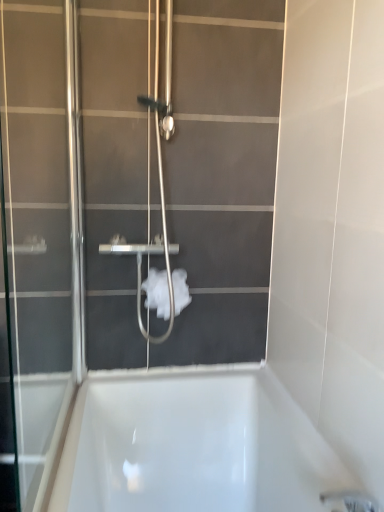
Where is `white fluffy toilet paper at center`? The height and width of the screenshot is (512, 384). white fluffy toilet paper at center is located at coordinates (157, 292).

In order to face white fluffy toilet paper at center, should I rotate leftwards or rightwards?

Rotate left and turn 3.543 degrees.

Measure the distance between point (153,284) and camera.

Point (153,284) is 4.65 feet from camera.

This screenshot has height=512, width=384. Describe the element at coordinates (157, 292) in the screenshot. I see `white fluffy toilet paper at center` at that location.

You are a GUI agent. You are given a task and a screenshot of the screen. Output one action in this format:
    pyautogui.click(x=<x>, y=<y>)
    Task: Click on the transparent glass screen door at left
    The image size is (384, 512).
    Given the screenshot: What is the action you would take?
    pyautogui.click(x=41, y=232)

What do you see at coordinates (41, 232) in the screenshot?
I see `transparent glass screen door at left` at bounding box center [41, 232].

Find the location of a particular element. The height and width of the screenshot is (512, 384). white fluffy toilet paper at center is located at coordinates (157, 292).

Is white fluffy toilet paper at center to the right of transparent glass screen door at left from the viewer's perspective?

Indeed, white fluffy toilet paper at center is positioned on the right side of transparent glass screen door at left.

Is white fluffy toilet paper at center behind transparent glass screen door at left?

Yes, white fluffy toilet paper at center is further from the camera.

Which point is more forward, (152, 296) or (58, 10)?

The point (58, 10) is more forward.

From the image's perspective, is white fluffy toilet paper at center located above or below transparent glass screen door at left?

Based on their image positions, white fluffy toilet paper at center is located beneath transparent glass screen door at left.

From a real-world perspective, between white fluffy toilet paper at center and transparent glass screen door at left, who is vertically lower?

white fluffy toilet paper at center, from a real-world perspective.

Is white fluffy toilet paper at center wider or thinner than transparent glass screen door at left?

white fluffy toilet paper at center is wider than transparent glass screen door at left.

Considering the sizes of objects white fluffy toilet paper at center and transparent glass screen door at left in the image provided, who is taller, white fluffy toilet paper at center or transparent glass screen door at left?

With more height is transparent glass screen door at left.

Considering the sizes of objects white fluffy toilet paper at center and transparent glass screen door at left in the image provided, who is bigger, white fluffy toilet paper at center or transparent glass screen door at left?

Bigger between the two is transparent glass screen door at left.

Is transparent glass screen door at left a part of white fluffy toilet paper at center?

That's incorrect, transparent glass screen door at left is not inside white fluffy toilet paper at center.

Is white fluffy toilet paper at center beside transparent glass screen door at left?

No.

Could you tell me if white fluffy toilet paper at center is facing transparent glass screen door at left?

No, white fluffy toilet paper at center is not aimed at transparent glass screen door at left.

How much distance is there between white fluffy toilet paper at center and transparent glass screen door at left?

white fluffy toilet paper at center and transparent glass screen door at left are 17.61 inches apart from each other.

Where is `screen door above the white fluffy toilet paper at center (from a real-world perspective)`? This screenshot has width=384, height=512. screen door above the white fluffy toilet paper at center (from a real-world perspective) is located at coordinates (41, 232).

From the picture: Between transparent glass screen door at left and white fluffy toilet paper at center, which one appears on the right side from the viewer's perspective?

white fluffy toilet paper at center is more to the right.

In the scene shown: Relative to white fluffy toilet paper at center, is transparent glass screen door at left in front or behind?

Visually, transparent glass screen door at left is located in front of white fluffy toilet paper at center.

Is point (57, 186) positioned in front of point (161, 301)?

That is True.

From the image's perspective, relative to white fluffy toilet paper at center, is transparent glass screen door at left above or below?

transparent glass screen door at left is above white fluffy toilet paper at center.

From a real-world perspective, is transparent glass screen door at left below white fluffy toilet paper at center?

No, from a real-world perspective, transparent glass screen door at left is not below white fluffy toilet paper at center.

Is transparent glass screen door at left thinner than white fluffy toilet paper at center?

Yes, transparent glass screen door at left is thinner than white fluffy toilet paper at center.

Does transparent glass screen door at left have a lesser height compared to white fluffy toilet paper at center?

No, transparent glass screen door at left is not shorter than white fluffy toilet paper at center.

Which of these two, transparent glass screen door at left or white fluffy toilet paper at center, is bigger?

Bigger between the two is transparent glass screen door at left.

Is white fluffy toilet paper at center completely or partially inside transparent glass screen door at left?

No, white fluffy toilet paper at center is not surrounded by transparent glass screen door at left.

Based on the photo, are transparent glass screen door at left and white fluffy toilet paper at center far apart?

No, transparent glass screen door at left is not far from white fluffy toilet paper at center.

Is transparent glass screen door at left facing towards white fluffy toilet paper at center?

No, transparent glass screen door at left is not turned towards white fluffy toilet paper at center.

What's the angular difference between transparent glass screen door at left and white fluffy toilet paper at center's facing directions?

The facing directions of transparent glass screen door at left and white fluffy toilet paper at center are 89 degrees apart.

How distant is transparent glass screen door at left from white fluffy toilet paper at center?

transparent glass screen door at left and white fluffy toilet paper at center are 17.61 inches apart.

The image size is (384, 512). Identify the location of screen door that is on the left side of white fluffy toilet paper at center. (41, 232).

Find the location of a particular element. toilet paper on the right of transparent glass screen door at left is located at coordinates (157, 292).

At what (x,y) coordinates should I click in order to perform the action: click on screen door above the white fluffy toilet paper at center (from the image's perspective). Please return your answer as a coordinate pair (x, y). This screenshot has height=512, width=384. Looking at the image, I should click on (41, 232).